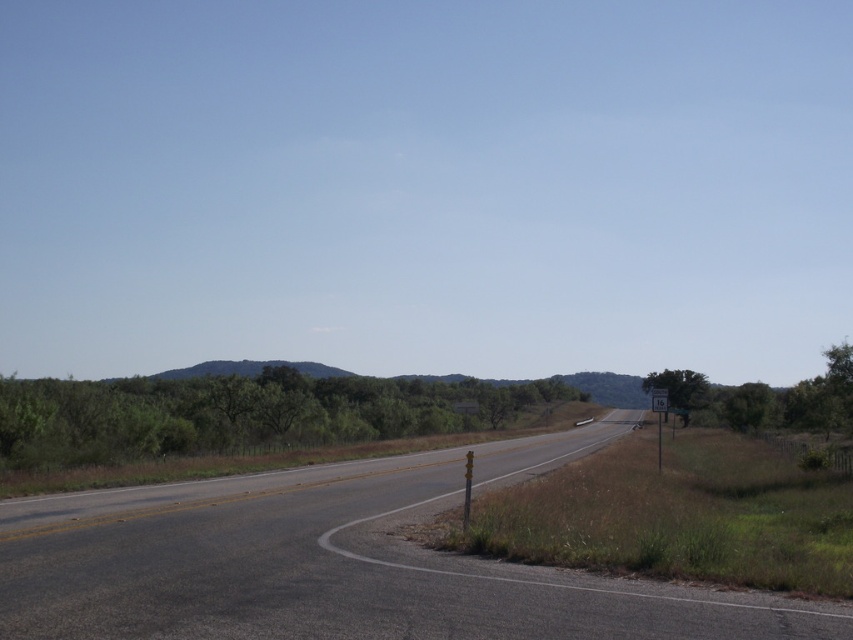
You are a driver approaching the rural road scene. You notice two green leafy trees ahead. The first is labeled as green leafy trees at center and the second is green leafy tree at right. Which tree would appear closer to you based on their positions?

The green leafy tree at right appears closer because it is positioned lower in the image, which typically indicates proximity in perspective.